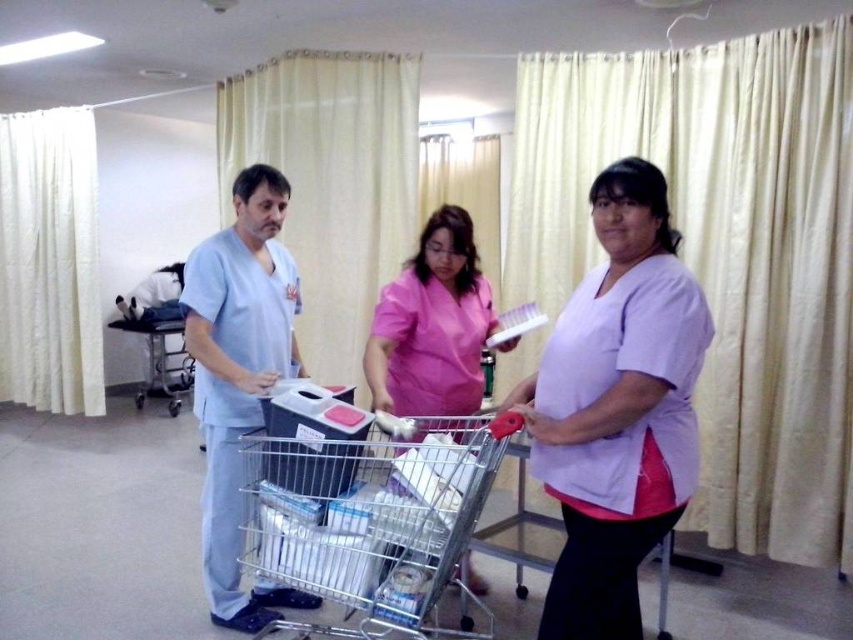
You are a patient in the hospital and need to locate two specific points in the room. The first point is at coordinates point (549, 424) and the second is at point (158, 365). Which point is closer to you?

Point (549, 424) is closer to the viewer than point (158, 365).

You are a nurse in the hospital and need to determine which clothing item is more suitable for a patient who requires a larger garment. Based on the scene, which of the two items, the purple fabric shirt at center or the light blue scrubs at center, would you recommend?

The light blue scrubs at center are larger than the purple fabric shirt at center, so the light blue scrubs at center would be more suitable for a patient needing a larger garment.

You are a patient in the hospital and need to locate the metallic silver trolley at left. From your perspective, is the purple fabric shirt at center blocking your view of the trolley?

Yes, the purple fabric shirt at center is in front of the metallic silver trolley at left, so it is blocking your view of the trolley.